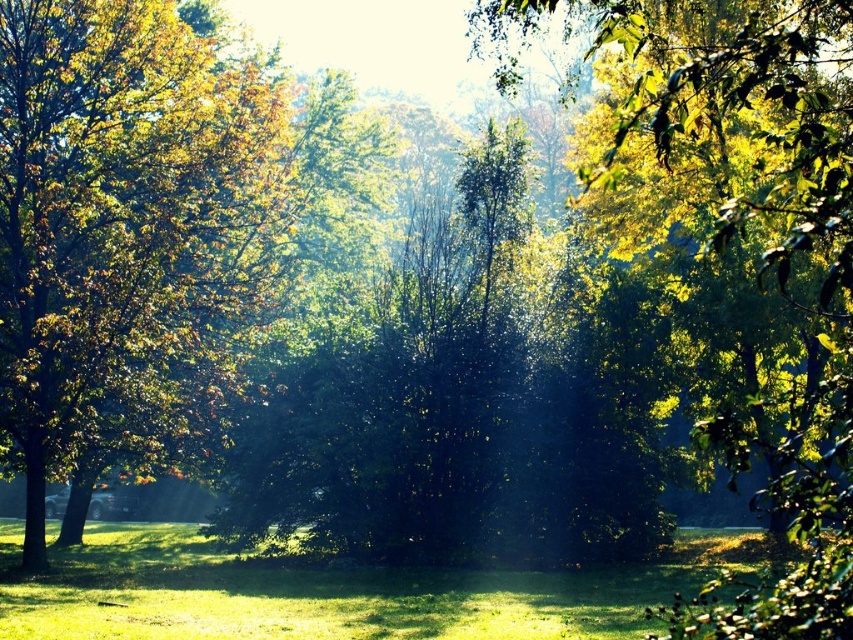
Does green leafy tree at left come behind green grass at center?

Yes, green leafy tree at left is behind green grass at center.

Between point (259, 102) and point (146, 561), which one is positioned behind?

The point (259, 102) is more distant.

Where is `green leafy tree at left`? This screenshot has width=853, height=640. green leafy tree at left is located at coordinates (129, 230).